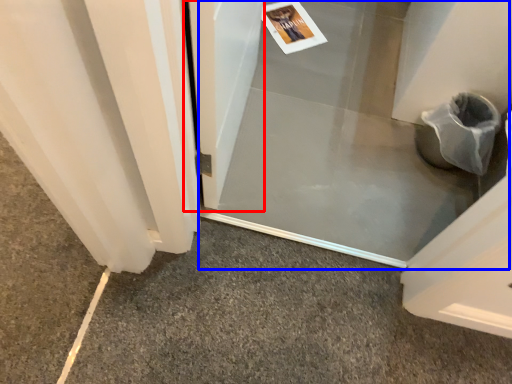
Question: Which point is further to the camera, screen door (highlighted by a red box) or screen door (highlighted by a blue box)?

Choices:
 (A) screen door
 (B) screen door

Answer: (B)